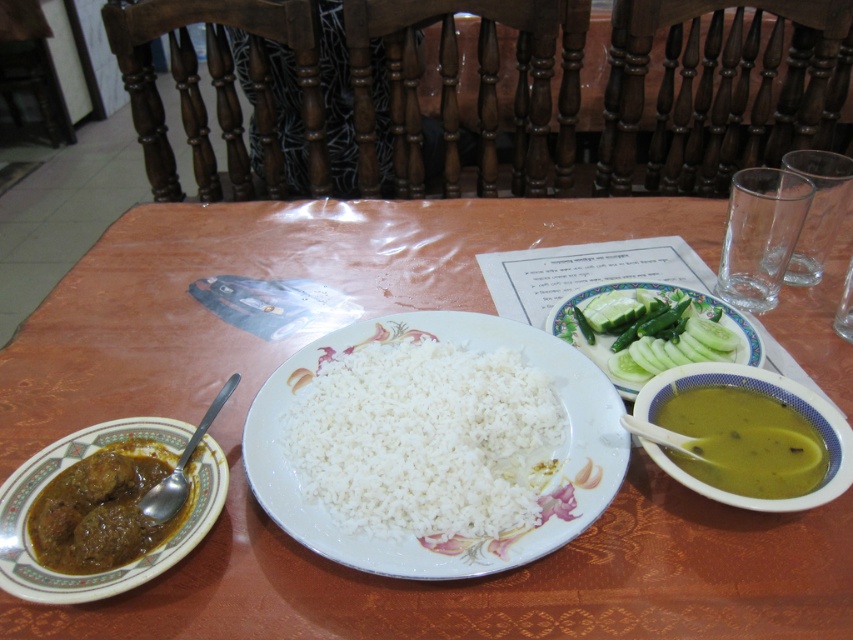
Based on the photo, you are a guest at a dinner table and want to reach for the green creamy soup at right without disturbing the white polished rice at center. Which direction should you move your hand to avoid the rice?

The white polished rice at center might be wider than the green creamy soup at right, so you should move your hand to the right side of the table to avoid the rice.

You are setting up a small decorative item on the table. The brown wooden table at center has limited space. Can the green plastic spoon at lower right be placed on the table without overlapping any existing items?

The brown wooden table at center is bigger than green plastic spoon at lower right, so yes, there should be enough space to place the green plastic spoon at lower right on the table without overlapping existing items.

You are standing at the edge of the table and want to place a napkin at point [368,316]. Is this point on the brown wooden table at center?

Yes, the point [368,316] is on the brown wooden table at center according to the description.